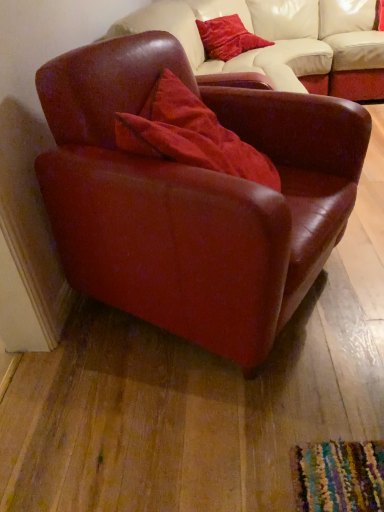
Question: Which direction should I rotate to look at velvet red pillow at upper center, the second pillow when ordered from bottom to top, — up or down?

Choices:
 (A) up
 (B) down

Answer: (A)

Question: Is velvet red pillow at center, placed as the first pillow when sorted from front to back, aimed at velvet red pillow at upper center, the second pillow when ordered from bottom to top?

Choices:
 (A) no
 (B) yes

Answer: (A)

Question: Does velvet red pillow at center, the 2th pillow when ordered from top to bottom, have a lesser width compared to velvet red pillow at upper center, the first pillow positioned from the back?

Choices:
 (A) no
 (B) yes

Answer: (A)

Question: Is velvet red pillow at center, the 1th pillow when ordered from bottom to top, to the left of velvet red pillow at upper center, the second pillow when ordered from bottom to top, from the viewer's perspective?

Choices:
 (A) no
 (B) yes

Answer: (B)

Question: From a real-world perspective, is velvet red pillow at center, the 2th pillow when ordered from top to bottom, over velvet red pillow at upper center, the first pillow positioned from the back?

Choices:
 (A) no
 (B) yes

Answer: (B)

Question: Is velvet red pillow at center, the 2th pillow when ordered from top to bottom, at the right side of velvet red pillow at upper center, marked as the 2th pillow in a front-to-back arrangement?

Choices:
 (A) yes
 (B) no

Answer: (B)

Question: Does velvet red pillow at center, the 2th pillow when ordered from top to bottom, have a smaller size compared to velvet red pillow at upper center, which is counted as the first pillow, starting from the top?

Choices:
 (A) no
 (B) yes

Answer: (A)

Question: Is matte leather armchair at center bigger than velvet red pillow at center, which ranks as the second pillow in back-to-front order?

Choices:
 (A) yes
 (B) no

Answer: (A)

Question: Does matte leather armchair at center appear on the left side of velvet red pillow at center, the 1th pillow when ordered from bottom to top?

Choices:
 (A) yes
 (B) no

Answer: (B)

Question: Is matte leather armchair at center directly adjacent to velvet red pillow at center, the 1th pillow when ordered from bottom to top?

Choices:
 (A) no
 (B) yes

Answer: (A)

Question: Does matte leather armchair at center appear on the right side of velvet red pillow at center, placed as the first pillow when sorted from front to back?

Choices:
 (A) yes
 (B) no

Answer: (A)

Question: Is matte leather armchair at center taller than velvet red pillow at center, placed as the first pillow when sorted from front to back?

Choices:
 (A) no
 (B) yes

Answer: (B)

Question: Does matte leather armchair at center have a greater width compared to velvet red pillow at center, which ranks as the second pillow in back-to-front order?

Choices:
 (A) no
 (B) yes

Answer: (B)

Question: Can you confirm if velvet red pillow at upper center, the first pillow positioned from the back, is wider than velvet red pillow at center, the 2th pillow when ordered from top to bottom?

Choices:
 (A) yes
 (B) no

Answer: (B)